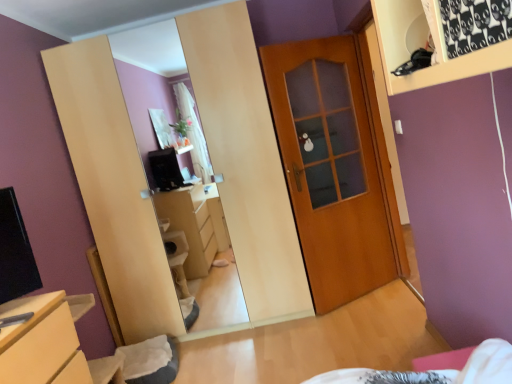
Question: Is matte wood chest of drawers at lower left closer to camera compared to black fabric at upper right?

Choices:
 (A) yes
 (B) no

Answer: (B)

Question: From the image's perspective, is matte wood chest of drawers at lower left under black fabric at upper right?

Choices:
 (A) yes
 (B) no

Answer: (A)

Question: From a real-world perspective, is matte wood chest of drawers at lower left located higher than black fabric at upper right?

Choices:
 (A) no
 (B) yes

Answer: (A)

Question: Is black fabric at upper right at the back of matte wood chest of drawers at lower left?

Choices:
 (A) no
 (B) yes

Answer: (A)

Question: Is matte wood chest of drawers at lower left positioned beyond the bounds of black fabric at upper right?

Choices:
 (A) yes
 (B) no

Answer: (A)

Question: Can you confirm if matte wood chest of drawers at lower left is positioned to the left of black fabric at upper right?

Choices:
 (A) no
 (B) yes

Answer: (B)

Question: Is black fabric at upper right taller than matte wood chest of drawers at lower left?

Choices:
 (A) yes
 (B) no

Answer: (B)

Question: Is black fabric at upper right bigger than matte wood chest of drawers at lower left?

Choices:
 (A) yes
 (B) no

Answer: (B)

Question: Is matte wood chest of drawers at lower left a part of black fabric at upper right?

Choices:
 (A) yes
 (B) no

Answer: (B)

Question: From a real-world perspective, does black fabric at upper right stand above matte wood chest of drawers at lower left?

Choices:
 (A) no
 (B) yes

Answer: (B)

Question: Is black fabric at upper right to the right of matte wood chest of drawers at lower left from the viewer's perspective?

Choices:
 (A) yes
 (B) no

Answer: (A)

Question: From a real-world perspective, is black fabric at upper right positioned under matte wood chest of drawers at lower left based on gravity?

Choices:
 (A) yes
 (B) no

Answer: (B)

Question: From a real-world perspective, is wooden door at center below black fabric at upper right?

Choices:
 (A) yes
 (B) no

Answer: (A)